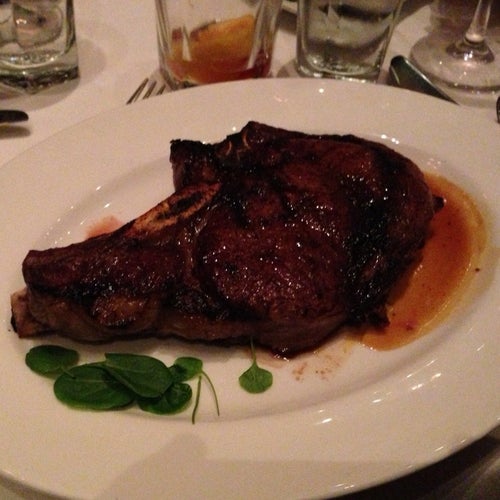
Locate an element on the screen. The height and width of the screenshot is (500, 500). plate is located at coordinates (181, 478).